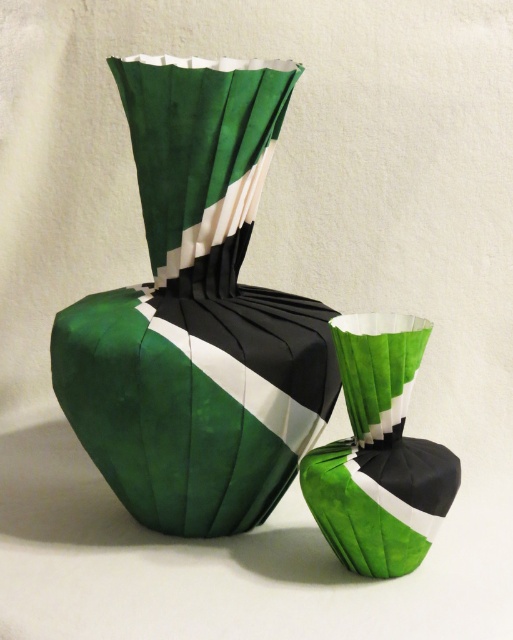
Question: Can you confirm if green paper vase at center is positioned above green paper at center?

Choices:
 (A) yes
 (B) no

Answer: (A)

Question: From the image, what is the correct spatial relationship of green paper vase at center in relation to green paper at center?

Choices:
 (A) below
 (B) above

Answer: (B)

Question: Which point is farther to the camera?

Choices:
 (A) (438, 490)
 (B) (146, 352)

Answer: (B)

Question: Where is green paper vase at center located in relation to green paper at center in the image?

Choices:
 (A) below
 (B) above

Answer: (B)